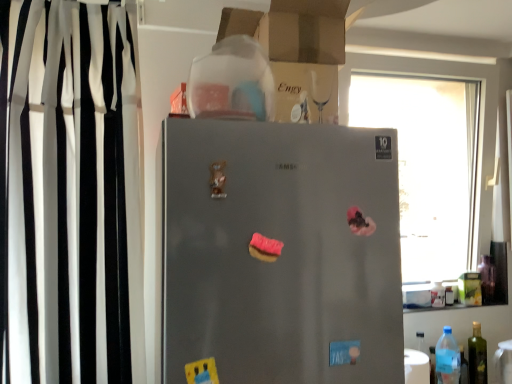
What do you see at coordinates (438, 295) in the screenshot? The width and height of the screenshot is (512, 384). I see `transparent plastic bottle at right, which is the third bottle in front-to-back order` at bounding box center [438, 295].

At what (x,y) coordinates should I click in order to perform the action: click on blue translucent bottle at lower right, the 3th bottle from the back. Please return your answer as a coordinate pair (x, y). Image resolution: width=512 pixels, height=384 pixels. Looking at the image, I should click on (447, 358).

This screenshot has width=512, height=384. Describe the element at coordinates (434, 155) in the screenshot. I see `transparent glass window at upper right` at that location.

Identify the location of cardboard box at upper center. The width and height of the screenshot is (512, 384). (297, 49).

Is black/white striped curtain at left not close to cardboard box at upper center?

No.

Visually, is black/white striped curtain at left positioned to the left or to the right of cardboard box at upper center?

From the image, it's evident that black/white striped curtain at left is to the left of cardboard box at upper center.

Is black/white striped curtain at left in front of or behind cardboard box at upper center in the image?

Visually, black/white striped curtain at left is located in front of cardboard box at upper center.

In order to click on cardboard box on the left of green glass bottle at lower right, the 3th bottle from the left in this screenshot , I will do `click(297, 49)`.

From a real-world perspective, is cardboard box at upper center positioned above or below green glass bottle at lower right, which is the 1th bottle in right-to-left order?

In terms of real-world spatial position, cardboard box at upper center is above green glass bottle at lower right, which is the 1th bottle in right-to-left order.

Which is farther, (x=288, y=93) or (x=474, y=376)?

The point (x=474, y=376) is behind.

How many degrees apart are the facing directions of pink glossy donut at center and transparent glass window at upper right?

1.81 degrees.

From a real-world perspective, is pink glossy donut at center beneath transparent glass window at upper right?

Yes.

Considering the sizes of pink glossy donut at center and transparent glass window at upper right in the image, is pink glossy donut at center bigger or smaller than transparent glass window at upper right?

pink glossy donut at center is smaller than transparent glass window at upper right.

From the image's perspective, which one is positioned lower, pink glossy donut at center or transparent glass window at upper right?

pink glossy donut at center, from the image's perspective.

Considering the positions of points (431, 210) and (314, 287), is point (431, 210) farther from camera compared to point (314, 287)?

That is True.

Between transparent glass window at upper right and satin silver fridge at center, which one has smaller size?

transparent glass window at upper right is smaller.

Is transparent glass window at upper right at the left side of satin silver fridge at center?

In fact, transparent glass window at upper right is to the right of satin silver fridge at center.

Is transparent glass window at upper right situated inside satin silver fridge at center or outside?

transparent glass window at upper right cannot be found inside satin silver fridge at center.

Which object is closer to the camera taking this photo, blue translucent bottle at lower right, positioned as the 1th bottle in front-to-back order, or satin silver fridge at center?

Positioned in front is satin silver fridge at center.

Is blue translucent bottle at lower right, the 3th bottle from the back, situated inside satin silver fridge at center or outside?

blue translucent bottle at lower right, the 3th bottle from the back, is spatially situated outside satin silver fridge at center.

Is blue translucent bottle at lower right, positioned as the 1th bottle in front-to-back order, positioned with its back to satin silver fridge at center?

blue translucent bottle at lower right, positioned as the 1th bottle in front-to-back order, does not have its back to satin silver fridge at center.

How different are the orientations of blue translucent bottle at lower right, placed as the 3th bottle when sorted from right to left, and satin silver fridge at center in degrees?

0.674 degrees.

Would you say pink glossy donut at center contains green glass bottle at lower right, which is the 2th bottle in front-to-back order?

That's incorrect, green glass bottle at lower right, which is the 2th bottle in front-to-back order, is not inside pink glossy donut at center.

From the image's perspective, is pink glossy donut at center above or below green glass bottle at lower right, the 3th bottle from the left?

Clearly, from the image's perspective, pink glossy donut at center is above green glass bottle at lower right, the 3th bottle from the left.

From a real-world perspective, is pink glossy donut at center located higher than green glass bottle at lower right, which is the second bottle in back-to-front order?

Yes, from a real-world perspective, pink glossy donut at center is above green glass bottle at lower right, which is the second bottle in back-to-front order.

Considering the points (93, 254) and (434, 292), which point is in front, point (93, 254) or point (434, 292)?

The point (93, 254) is closer to the camera.

Can we say black/white striped curtain at left lies outside transparent plastic bottle at right, which is the second bottle in right-to-left order?

Indeed, black/white striped curtain at left is completely outside transparent plastic bottle at right, which is the second bottle in right-to-left order.

The width and height of the screenshot is (512, 384). What are the coordinates of `curtain in front of the transparent plastic bottle at right, which is counted as the 1th bottle, starting from the back` in the screenshot? It's located at (66, 192).

From a real-world perspective, is black/white striped curtain at left physically located above or below transparent plastic bottle at right, which is counted as the 1th bottle, starting from the back?

In terms of real-world spatial position, black/white striped curtain at left is above transparent plastic bottle at right, which is counted as the 1th bottle, starting from the back.

Identify the location of curtain in front of the cardboard box at upper center. pos(66,192).

Where is `the 3rd bottle below the cardboard box at upper center (from the image's perspective)`? The image size is (512, 384). the 3rd bottle below the cardboard box at upper center (from the image's perspective) is located at coordinates (477, 356).

From the image, which object appears to be nearer to transparent plastic bottle at right, which is the third bottle in front-to-back order, transparent glass window at upper right or satin silver fridge at center?

transparent glass window at upper right.

In the scene shown: Based on their spatial positions, is transparent glass window at upper right or satin silver fridge at center further from green glass bottle at lower right, which is the 1th bottle in right-to-left order?

satin silver fridge at center.

Based on their spatial positions, is transparent plastic bottle at right, which is the second bottle in right-to-left order, or satin silver fridge at center further from pink glossy donut at center?

Among the two, transparent plastic bottle at right, which is the second bottle in right-to-left order, is located further to pink glossy donut at center.

Considering their positions, is pink glossy donut at center positioned closer to black/white striped curtain at left than satin silver fridge at center?

satin silver fridge at center lies closer to black/white striped curtain at left than the other object.

Looking at the image, which one is located closer to transparent plastic bottle at right, which is counted as the 1th bottle, starting from the back, satin silver fridge at center or cardboard box at upper center?

The object closer to transparent plastic bottle at right, which is counted as the 1th bottle, starting from the back, is satin silver fridge at center.

Which object lies nearer to the anchor point satin silver fridge at center, transparent glass window at upper right or blue translucent bottle at lower right, positioned as the 1th bottle in front-to-back order?

Among the two, blue translucent bottle at lower right, positioned as the 1th bottle in front-to-back order, is located nearer to satin silver fridge at center.

Estimate the real-world distances between objects in this image. Which object is further from cardboard box at upper center, green glass bottle at lower right, which is the 1th bottle in right-to-left order, or pink glossy donut at center?

Based on the image, green glass bottle at lower right, which is the 1th bottle in right-to-left order, appears to be further to cardboard box at upper center.

Estimate the real-world distances between objects in this image. Which object is closer to cardboard box at upper center, blue translucent bottle at lower right, positioned as the 1th bottle in front-to-back order, or pink glossy donut at center?

The object closer to cardboard box at upper center is pink glossy donut at center.

Where is `refrigerator between pink glossy donut at center and blue translucent bottle at lower right, positioned as the 1th bottle in front-to-back order, in the horizontal direction`? The height and width of the screenshot is (384, 512). refrigerator between pink glossy donut at center and blue translucent bottle at lower right, positioned as the 1th bottle in front-to-back order, in the horizontal direction is located at coordinates (281, 253).

Image resolution: width=512 pixels, height=384 pixels. I want to click on window located between black/white striped curtain at left and transparent plastic bottle at right, which is the second bottle in right-to-left order, in the left-right direction, so click(434, 155).

Identify the location of cardboard box between black/white striped curtain at left and transparent glass window at upper right from left to right. The width and height of the screenshot is (512, 384). (297, 49).

Identify the location of window between cardboard box at upper center and transparent plastic bottle at right, which is the third bottle in front-to-back order, from top to bottom. (434, 155).